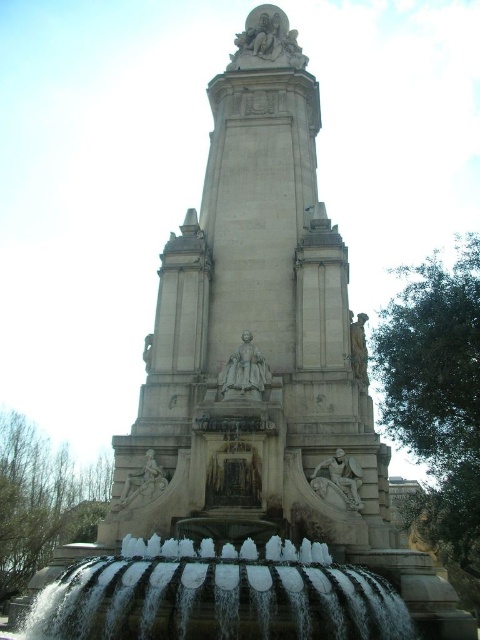
You are an art student analyzing the monument. You notice the polished stone sculpture at upper center and the white marble relief at center. According to their positions, which one is located to the left of the other?

The polished stone sculpture at upper center is to the left of the white marble relief at center.

You are standing in front of the grand stone monument and want to determine which of the two points, point (231, 54) or point (119, 506), is closer to you. Based on the monument layout, which point is nearer?

Point (231, 54) is further to the viewer than point (119, 506), so the closer point to you is point (119, 506).